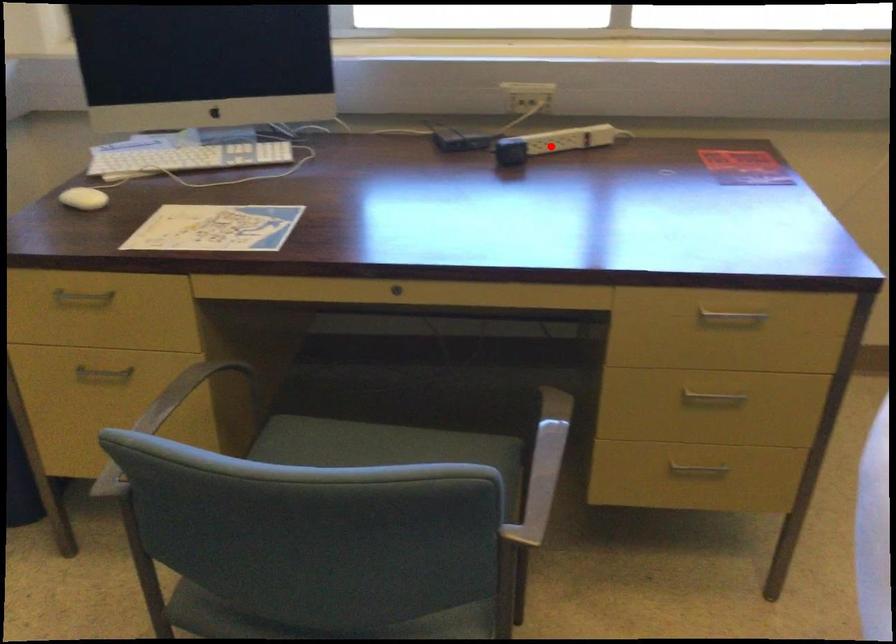
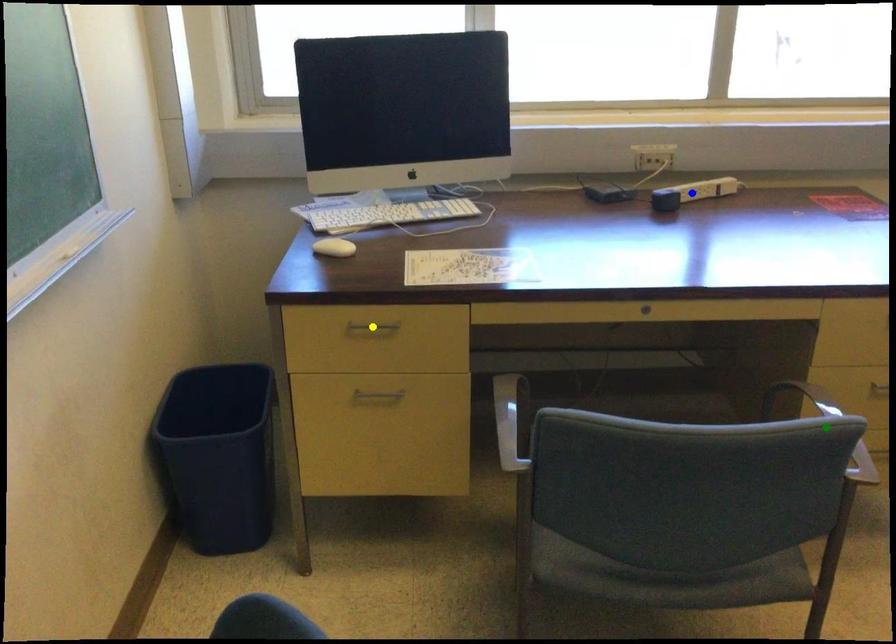
Question: I am providing you with two images of the same scene from different viewpoints. A red point is marked on the first image. You are given multiple points on the second image. In image 2, which mark is for the same physical point as the one in image 1?

Choices:
 (A) green point
 (B) yellow point
 (C) blue point

Answer: (C)